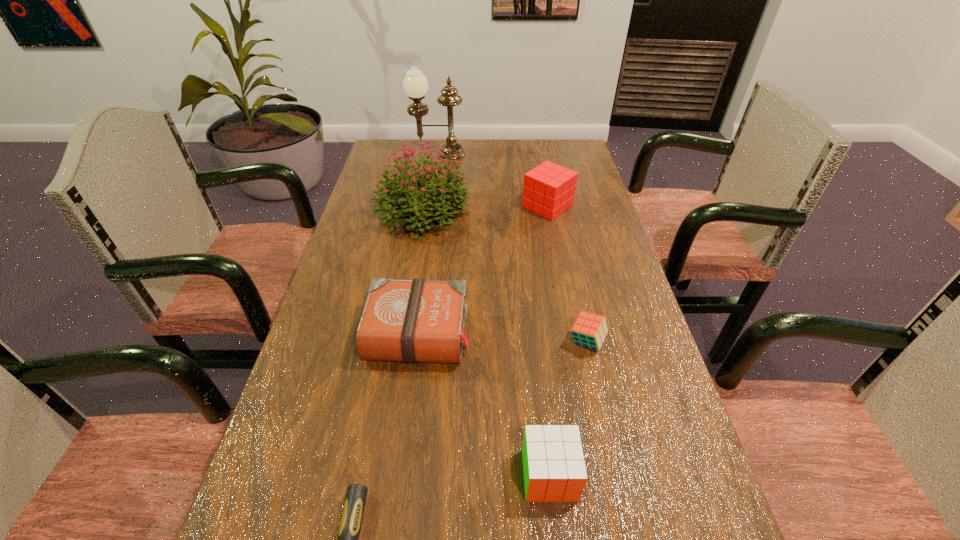
The width and height of the screenshot is (960, 540). Identify the location of free location at the far edge of the desktop. (528, 161).

At what (x,y) coordinates should I click in order to perform the action: click on vacant space at the left edge of the desktop. Please return your answer as a coordinate pair (x, y). This screenshot has height=540, width=960. Looking at the image, I should click on (344, 264).

Locate an element on the screen. The image size is (960, 540). vacant space at the right edge of the desktop is located at coordinates (596, 253).

Where is `blank space at the far right corner of the desktop`? The image size is (960, 540). blank space at the far right corner of the desktop is located at coordinates (543, 161).

Find the location of `free area in between the shortest cube and the tallest object`. free area in between the shortest cube and the tallest object is located at coordinates (513, 248).

Identify the location of vacant space that's between the Bible and the nearest cube. The image size is (960, 540). (485, 403).

The height and width of the screenshot is (540, 960). Find the location of `free spot between the third tallest object and the nearest cube`. free spot between the third tallest object and the nearest cube is located at coordinates (548, 340).

Locate an element on the screen. The width and height of the screenshot is (960, 540). empty location between the oil lamp and the Bible is located at coordinates (429, 242).

What are the coordinates of `unoccupied position between the nearest cube and the Bible` in the screenshot? It's located at (485, 403).

I want to click on object that is the fifth closest one to the nearest cube, so click(549, 189).